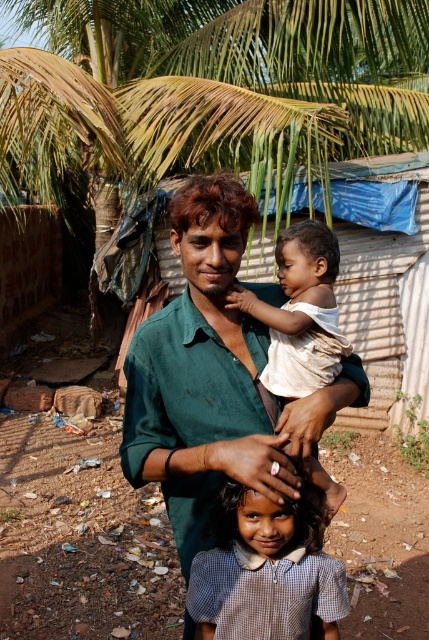
You are a photographer trying to capture a photo of the two people wearing the green cotton shirt at center and the white cotton shirt at center. Since you want to ensure both are fully visible in the frame, which person should you position closer to the camera to avoid being cut off?

The white cotton shirt at center should be positioned closer to the camera because it is shorter than the green cotton shirt at center, ensuring both are fully visible in the frame.

You are standing at the point with coordinates point (314, 364) and want to walk to the point with coordinates point (230, 515). Which direction should you move to reach there?

You should move forward because point (230, 515) is in front of point (314, 364).